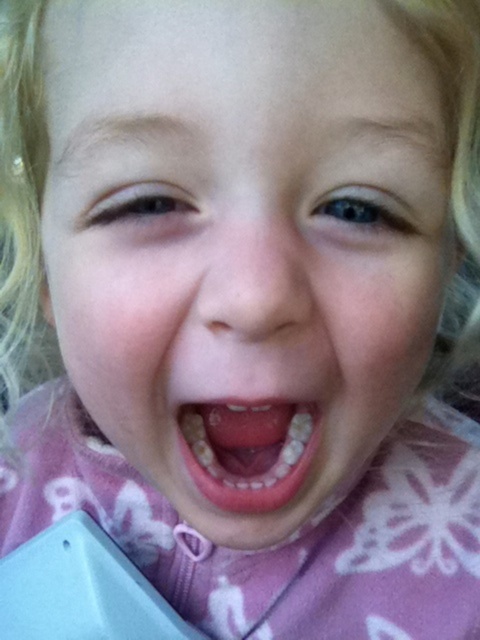
Is pink fabric face at center shorter than yellowish toothpaste at center?

In fact, pink fabric face at center may be taller than yellowish toothpaste at center.

Is pink fabric face at center positioned in front of yellowish toothpaste at center?

That is True.

In order to click on pink fabric face at center in this screenshot , I will do `click(243, 243)`.

Find the location of a particular element. Image resolution: width=480 pixels, height=640 pixels. pink fabric face at center is located at coordinates (243, 243).